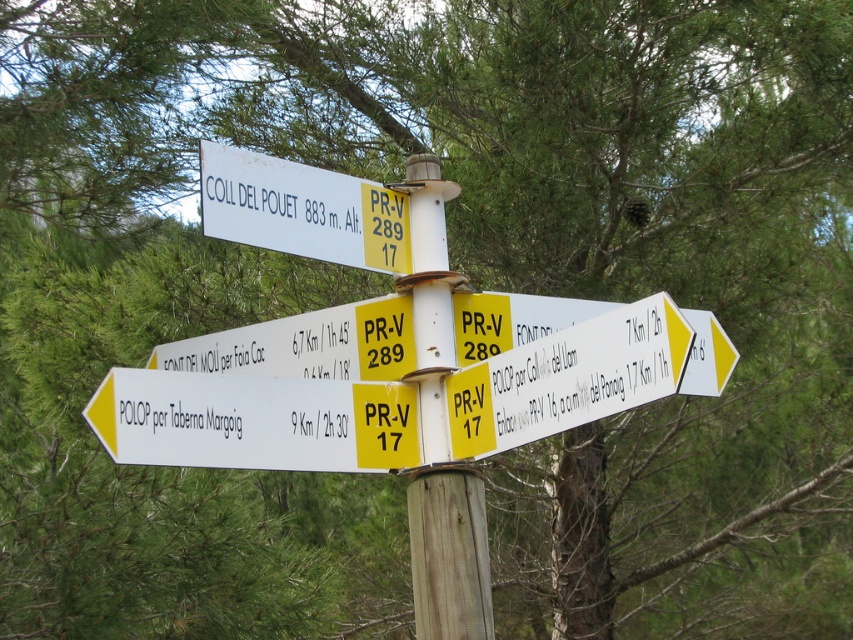
You are standing at the camera position and want to reach the point at coordinates (x=442, y=273). Given that your maximum walking distance is 10 meters, can you reach it without exceeding your limit?

The distance between you and the point at coordinates (x=442, y=273) is 9.87 meters, which is within your maximum walking distance of 10 meters. Therefore, you can reach it without exceeding your limit.

You are a hiker carrying a backpack and need to reach the COLL DEL POUET trailhead. You see the white plastic sign at lower left and the white wooden post at center. Can you comfortably walk between them without touching either?

The distance between the white plastic sign at lower left and the white wooden post at center is 1.06 meters. Since this distance is narrow, it may be tight for a hiker with a backpack to pass comfortably without touching either object. Consider moving sideways or checking for a wider path.